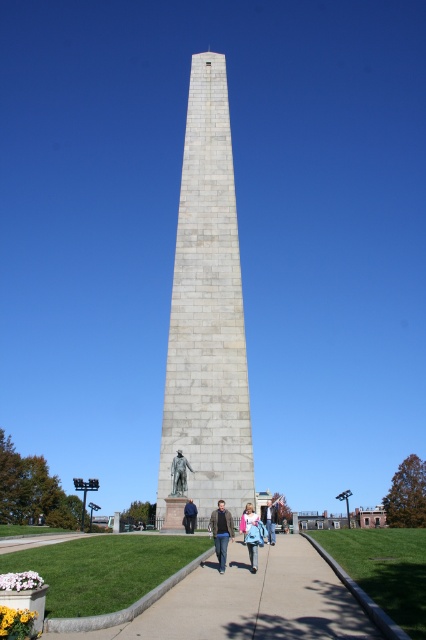
Question: Among these points, which one is farthest from the camera?

Choices:
 (A) (270, 544)
 (B) (215, 525)
 (C) (288, 531)

Answer: (C)

Question: Which object is the closest to the white stone obelisk at center?

Choices:
 (A) blue denim jeans at center
 (B) blue denim jacket at lower center
 (C) concrete at center
 (D) blue fabric jacket at center

Answer: (D)

Question: Can you confirm if polished bronze statue at center is positioned below light blue denim jeans at lower center?

Choices:
 (A) no
 (B) yes

Answer: (A)

Question: Is light blue denim jeans at lower center positioned before blue denim jeans at center?

Choices:
 (A) no
 (B) yes

Answer: (B)

Question: Is polished bronze statue at center smaller than blue denim jeans at lower center?

Choices:
 (A) yes
 (B) no

Answer: (A)

Question: Estimate the real-world distances between objects in this image. Which object is closer to the blue denim jacket at lower center?

Choices:
 (A) light blue denim jeans at lower center
 (B) blue fabric jacket at center
 (C) concrete at center

Answer: (A)